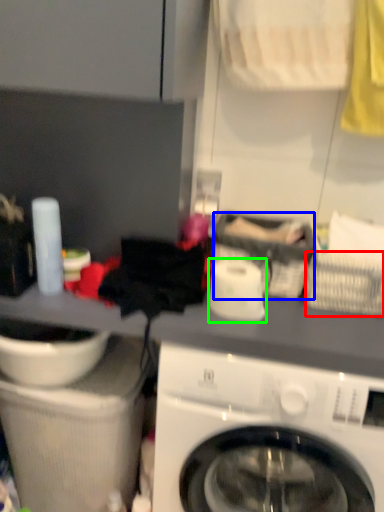
Question: Considering the real-world distances, which object is farthest from basket (highlighted by a red box)? basket (highlighted by a blue box) or toilet paper (highlighted by a green box)?

Choices:
 (A) basket
 (B) toilet paper

Answer: (B)